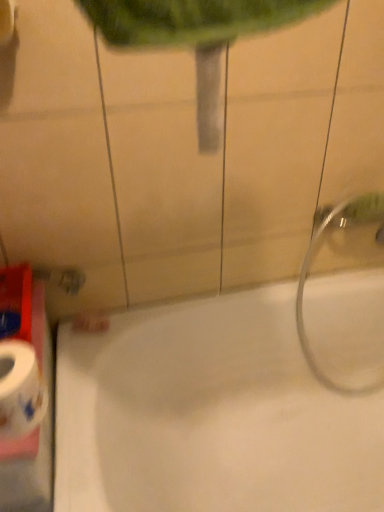
Question: Would you say silver metallic showerhead at right is outside white glossy toilet paper at lower left?

Choices:
 (A) no
 (B) yes

Answer: (B)

Question: Is the position of silver metallic showerhead at right less distant than that of white glossy toilet paper at lower left?

Choices:
 (A) no
 (B) yes

Answer: (A)

Question: From the image's perspective, is silver metallic showerhead at right located above white glossy toilet paper at lower left?

Choices:
 (A) no
 (B) yes

Answer: (B)

Question: Can you confirm if silver metallic showerhead at right is taller than white glossy toilet paper at lower left?

Choices:
 (A) yes
 (B) no

Answer: (A)

Question: Is silver metallic showerhead at right shorter than white glossy toilet paper at lower left?

Choices:
 (A) yes
 (B) no

Answer: (B)

Question: Is silver metallic showerhead at right thinner than white glossy toilet paper at lower left?

Choices:
 (A) yes
 (B) no

Answer: (B)

Question: Is white glossy bathtub at lower right surrounded by white glossy toilet paper at lower left?

Choices:
 (A) yes
 (B) no

Answer: (B)

Question: From the image's perspective, would you say white glossy toilet paper at lower left is shown under white glossy bathtub at lower right?

Choices:
 (A) yes
 (B) no

Answer: (B)

Question: From a real-world perspective, is white glossy toilet paper at lower left located higher than white glossy bathtub at lower right?

Choices:
 (A) yes
 (B) no

Answer: (A)

Question: Could you tell me if white glossy toilet paper at lower left is turned towards white glossy bathtub at lower right?

Choices:
 (A) yes
 (B) no

Answer: (B)

Question: Is white glossy toilet paper at lower left outside of white glossy bathtub at lower right?

Choices:
 (A) yes
 (B) no

Answer: (A)

Question: From the image's perspective, does white glossy toilet paper at lower left appear higher than white glossy bathtub at lower right?

Choices:
 (A) no
 (B) yes

Answer: (B)

Question: Is silver metallic showerhead at right positioned behind white glossy bathtub at lower right?

Choices:
 (A) no
 (B) yes

Answer: (B)